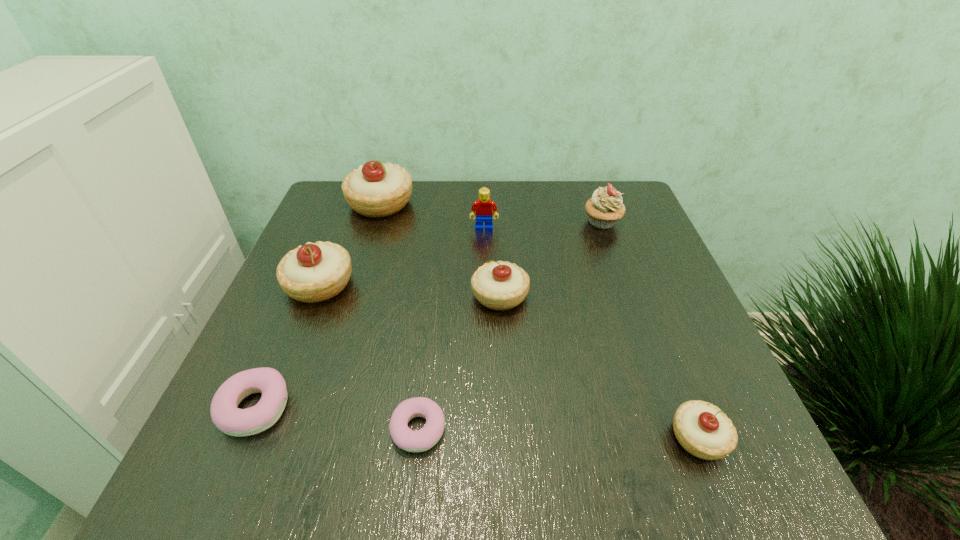
You are a GUI agent. You are given a task and a screenshot of the screen. Output one action in this format:
    pyautogui.click(x=<x>, y=<y>)
    Task: Click on the free point located 0.150m on the right of the shortest pastry
    This screenshot has width=960, height=540.
    Given the screenshot: What is the action you would take?
    pyautogui.click(x=540, y=429)

Identify the location of pastry that is at the far edge. (375, 189).

In order to click on cupcake located in the far edge section of the desktop in this screenshot , I will do click(605, 208).

The width and height of the screenshot is (960, 540). I want to click on Lego at the far edge, so click(x=482, y=208).

Locate an element on the screen. cupcake that is at the right edge is located at coordinates (605, 208).

At what (x,y) coordinates should I click in order to perform the action: click on pastry positioned at the right edge. Please return your answer as a coordinate pair (x, y). This screenshot has width=960, height=540. Looking at the image, I should click on (702, 429).

This screenshot has width=960, height=540. I want to click on object at the far left corner, so click(x=375, y=189).

Where is `object that is positioned at the near left corner`? This screenshot has height=540, width=960. object that is positioned at the near left corner is located at coordinates tap(231, 420).

Locate an element on the screen. The height and width of the screenshot is (540, 960). object that is at the far right corner is located at coordinates [605, 208].

Where is `object present at the near right corner`? The width and height of the screenshot is (960, 540). object present at the near right corner is located at coordinates (702, 429).